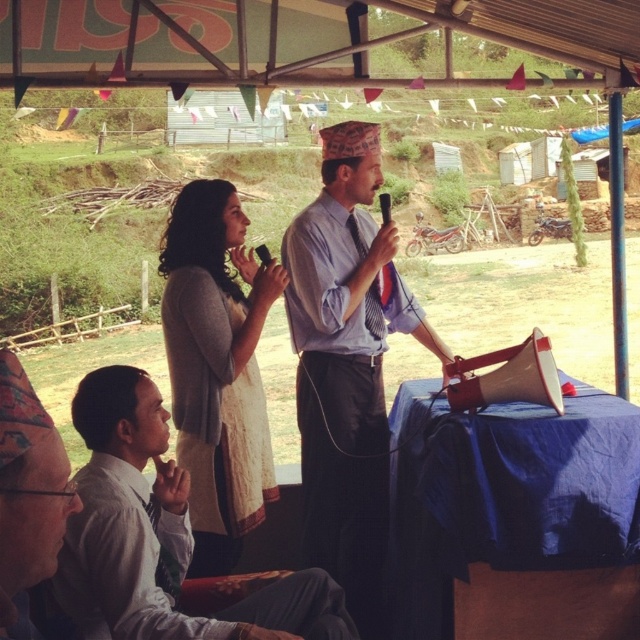
Question: Does blue striped shirt at center appear over light beige fabric dress at center?

Choices:
 (A) no
 (B) yes

Answer: (A)

Question: Can you confirm if blue striped shirt at center is positioned below light gray shirt at lower left?

Choices:
 (A) yes
 (B) no

Answer: (B)

Question: Which object is positioned closest to the blue fabric tablecloth at lower right?

Choices:
 (A) blue striped shirt at center
 (B) matte black shirt at lower left
 (C) light beige fabric dress at center
 (D) black plastic microphone at center

Answer: (A)

Question: Is blue fabric tablecloth at lower right thinner than blue striped shirt at center?

Choices:
 (A) no
 (B) yes

Answer: (A)

Question: Which of the following is the closest to the observer?

Choices:
 (A) (618, 499)
 (B) (17, 632)
 (C) (332, 504)

Answer: (B)

Question: Which of the following is the farthest from the observer?

Choices:
 (A) (193, 561)
 (B) (170, 580)

Answer: (A)